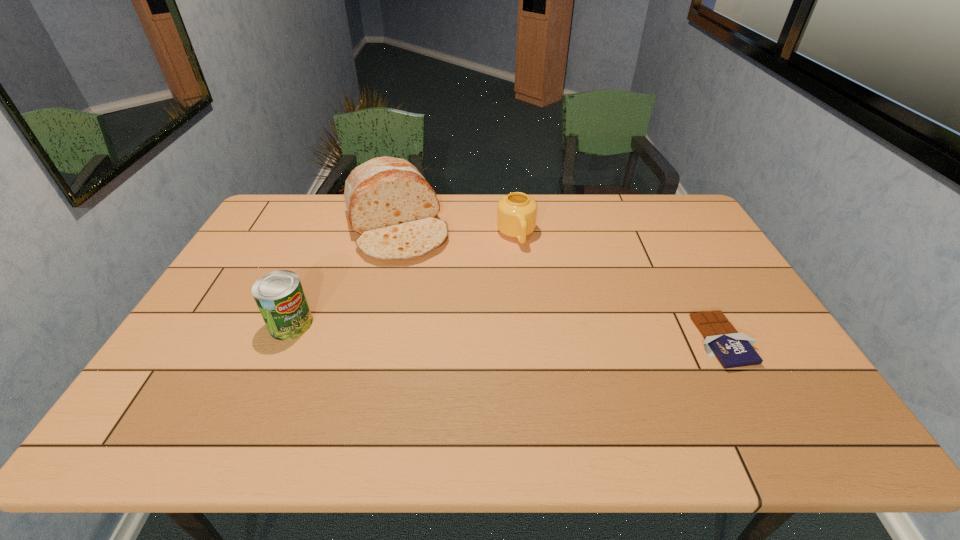
Locate an element on the screen. This screenshot has height=540, width=960. free location at the right edge is located at coordinates (765, 357).

You are a GUI agent. You are given a task and a screenshot of the screen. Output one action in this format:
    pyautogui.click(x=<x>, y=<y>)
    Task: Click on the vacant space at the far left corner
    Image resolution: width=960 pixels, height=540 pixels.
    Given the screenshot: What is the action you would take?
    pyautogui.click(x=282, y=206)

This screenshot has width=960, height=540. What are the coordinates of `vacant region at the near left corner of the desktop` in the screenshot? It's located at pos(194,384).

What are the coordinates of `vacant space at the near right corner of the desktop` in the screenshot? It's located at (752, 370).

Image resolution: width=960 pixels, height=540 pixels. I want to click on free space between the third object from left to right and the chocolate bar, so [x=620, y=288].

Locate an element on the screen. The image size is (960, 540). free spot between the can and the shortest object is located at coordinates (507, 332).

I want to click on vacant area that lies between the tallest object and the mug, so click(x=456, y=231).

Where is `vacant space that's between the chocolate bar and the bread`? vacant space that's between the chocolate bar and the bread is located at coordinates (560, 284).

Where is `free spot between the third object from left to right and the shortest object`? The height and width of the screenshot is (540, 960). free spot between the third object from left to right and the shortest object is located at coordinates (620, 288).

Identify the location of free spot between the shortest object and the can. coord(507,332).